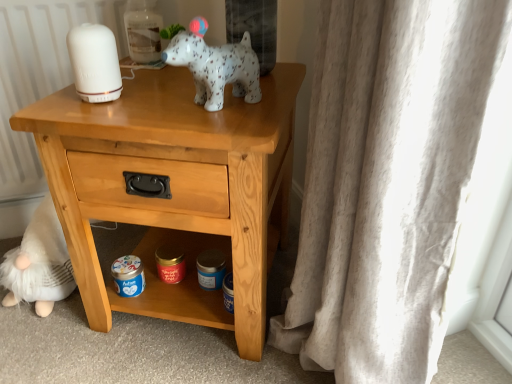
The height and width of the screenshot is (384, 512). Identify the location of unoccupied space behind white speckled ceramic dog at upper center. (193, 81).